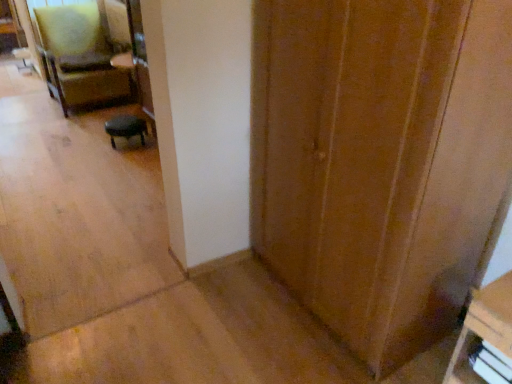
Question: Is wooden bookshelf at lower right, the second furniture viewed from the back, shorter than white plastic drawer at lower right?

Choices:
 (A) yes
 (B) no

Answer: (B)

Question: Is wooden bookshelf at lower right, arranged as the second furniture when viewed from the top, taller than white plastic drawer at lower right?

Choices:
 (A) yes
 (B) no

Answer: (A)

Question: From a real-world perspective, is wooden bookshelf at lower right, arranged as the second furniture when viewed from the top, on top of white plastic drawer at lower right?

Choices:
 (A) yes
 (B) no

Answer: (A)

Question: From a real-world perspective, is wooden bookshelf at lower right, arranged as the second furniture when viewed from the top, physically below white plastic drawer at lower right?

Choices:
 (A) yes
 (B) no

Answer: (B)

Question: Is wooden bookshelf at lower right, the second furniture viewed from the back, smaller than white plastic drawer at lower right?

Choices:
 (A) yes
 (B) no

Answer: (B)

Question: Does wooden bookshelf at lower right, acting as the 2th furniture starting from the left, have a larger size compared to white plastic drawer at lower right?

Choices:
 (A) yes
 (B) no

Answer: (A)

Question: From the image's perspective, does wooden bookshelf at lower right, arranged as the second furniture when viewed from the top, appear lower than velvet green armchair at upper left?

Choices:
 (A) no
 (B) yes

Answer: (B)

Question: Considering the relative positions of wooden bookshelf at lower right, acting as the 2th furniture starting from the left, and velvet green armchair at upper left in the image provided, is wooden bookshelf at lower right, acting as the 2th furniture starting from the left, behind velvet green armchair at upper left?

Choices:
 (A) yes
 (B) no

Answer: (B)

Question: Can you confirm if wooden bookshelf at lower right, arranged as the second furniture when viewed from the top, is taller than velvet green armchair at upper left?

Choices:
 (A) no
 (B) yes

Answer: (A)

Question: Considering the relative sizes of wooden bookshelf at lower right, arranged as the second furniture when viewed from the top, and velvet green armchair at upper left in the image provided, is wooden bookshelf at lower right, arranged as the second furniture when viewed from the top, wider than velvet green armchair at upper left?

Choices:
 (A) yes
 (B) no

Answer: (B)

Question: From the image's perspective, is wooden bookshelf at lower right, the second furniture viewed from the back, above velvet green armchair at upper left?

Choices:
 (A) yes
 (B) no

Answer: (B)

Question: Is the surface of wooden bookshelf at lower right, arranged as the first furniture when viewed from the front, in direct contact with velvet green armchair at upper left?

Choices:
 (A) no
 (B) yes

Answer: (A)

Question: Is wooden door at center wider than black leather stool at center, the second furniture in the bottom-to-top sequence?

Choices:
 (A) yes
 (B) no

Answer: (A)